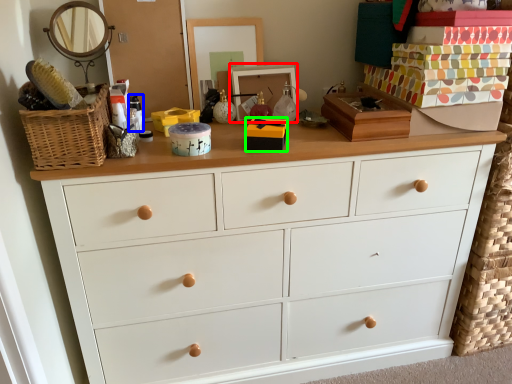
Question: Considering the real-world distances, which object is farthest from picture frame (highlighted by a red box)? toiletry (highlighted by a blue box) or box (highlighted by a green box)?

Choices:
 (A) toiletry
 (B) box

Answer: (A)